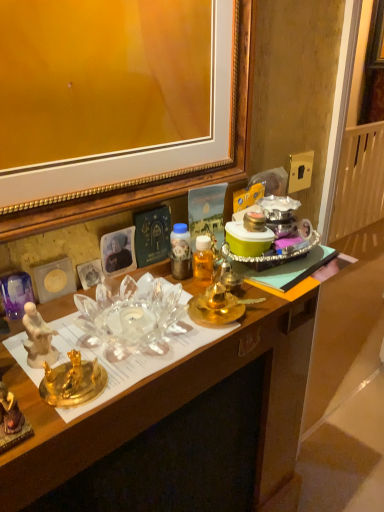
Question: From the image's perspective, would you say gold metallic power outlet at upper right is positioned over transparent glass bowl at center?

Choices:
 (A) no
 (B) yes

Answer: (B)

Question: Is gold metallic power outlet at upper right not close to transparent glass bowl at center?

Choices:
 (A) yes
 (B) no

Answer: (B)

Question: From the image's perspective, is gold metallic power outlet at upper right below transparent glass bowl at center?

Choices:
 (A) yes
 (B) no

Answer: (B)

Question: Does gold metallic power outlet at upper right appear on the left side of transparent glass bowl at center?

Choices:
 (A) yes
 (B) no

Answer: (B)

Question: Is transparent glass bowl at center inside gold metallic power outlet at upper right?

Choices:
 (A) yes
 (B) no

Answer: (B)

Question: Is gold metallic power outlet at upper right directly adjacent to transparent glass bowl at center?

Choices:
 (A) no
 (B) yes

Answer: (A)

Question: From the image's perspective, is transparent glass bowl at center located beneath gold metallic power outlet at upper right?

Choices:
 (A) no
 (B) yes

Answer: (B)

Question: Considering the relative positions of transparent glass bowl at center and gold metallic power outlet at upper right in the image provided, is transparent glass bowl at center to the right of gold metallic power outlet at upper right from the viewer's perspective?

Choices:
 (A) yes
 (B) no

Answer: (B)

Question: From the image's perspective, is transparent glass bowl at center over gold metallic power outlet at upper right?

Choices:
 (A) no
 (B) yes

Answer: (A)

Question: Is transparent glass bowl at center far from gold metallic power outlet at upper right?

Choices:
 (A) yes
 (B) no

Answer: (B)

Question: Is transparent glass bowl at center shorter than gold metallic power outlet at upper right?

Choices:
 (A) yes
 (B) no

Answer: (B)

Question: Is transparent glass bowl at center bigger than gold metallic power outlet at upper right?

Choices:
 (A) no
 (B) yes

Answer: (B)

Question: Is white porcelain plate at left positioned with its back to gold metallic power outlet at upper right?

Choices:
 (A) no
 (B) yes

Answer: (A)